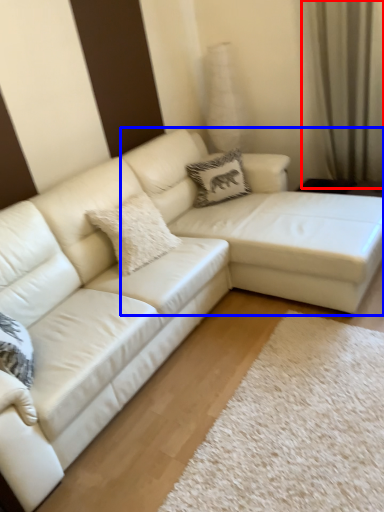
Question: Which object is closer to the camera taking this photo, curtain (highlighted by a red box) or couch (highlighted by a blue box)?

Choices:
 (A) curtain
 (B) couch

Answer: (B)